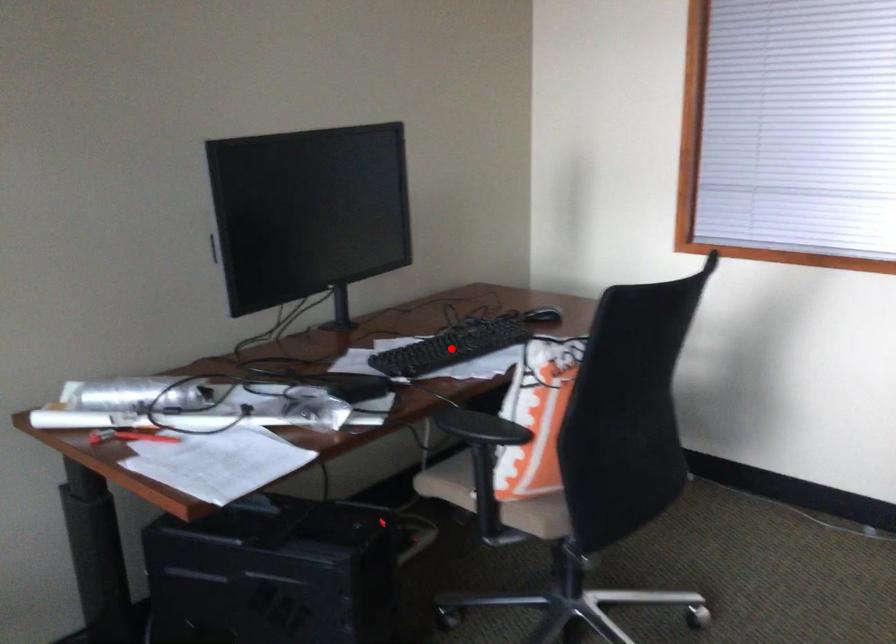
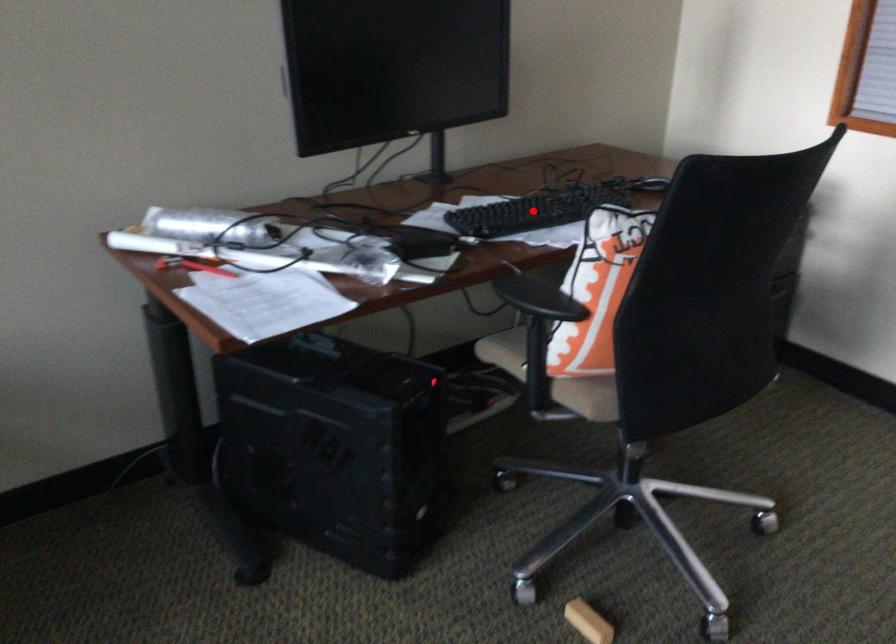
I am providing you with two images of the same scene from different viewpoints. A red point is marked on the first image and another point is marked on the second image. Is the red point in image1 aligned with the point shown in image2?

Yes